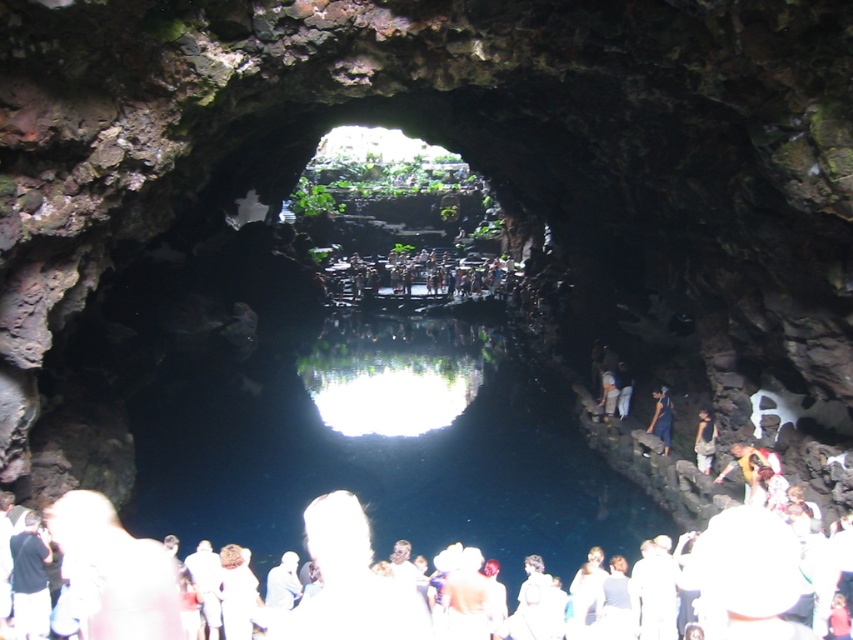
Is light brown fabric shirt at center smaller than dark blue jeans at center?

Yes.

The width and height of the screenshot is (853, 640). I want to click on light brown fabric shirt at center, so click(704, 442).